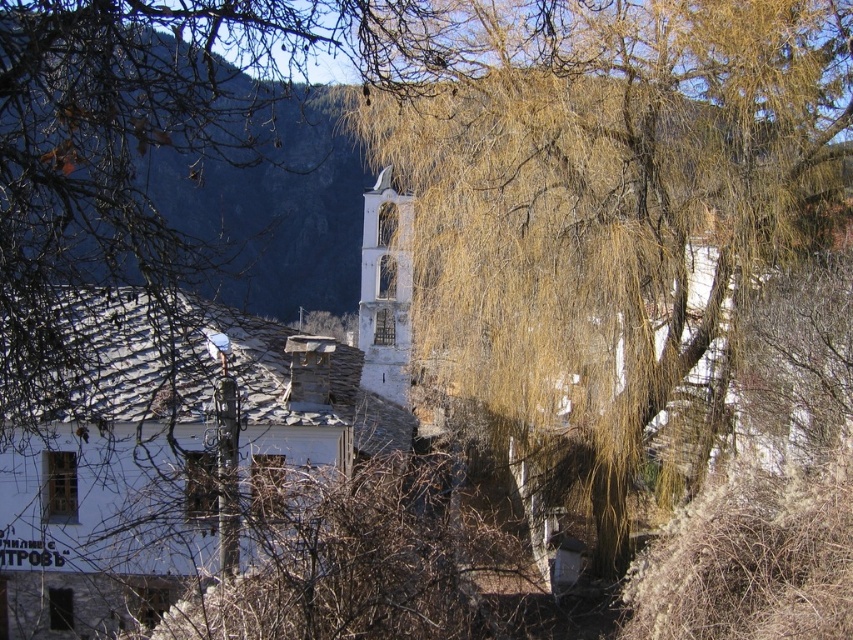
Question: Where is golden-brown textured willow at center located in relation to white stone bell tower at center in the image?

Choices:
 (A) below
 (B) above

Answer: (A)

Question: Considering the relative positions of golden-brown textured willow at center and white stone bell tower at center in the image provided, where is golden-brown textured willow at center located with respect to white stone bell tower at center?

Choices:
 (A) left
 (B) right

Answer: (B)

Question: Observing the image, what is the correct spatial positioning of golden-brown textured willow at center in reference to white stone bell tower at center?

Choices:
 (A) below
 (B) above

Answer: (A)